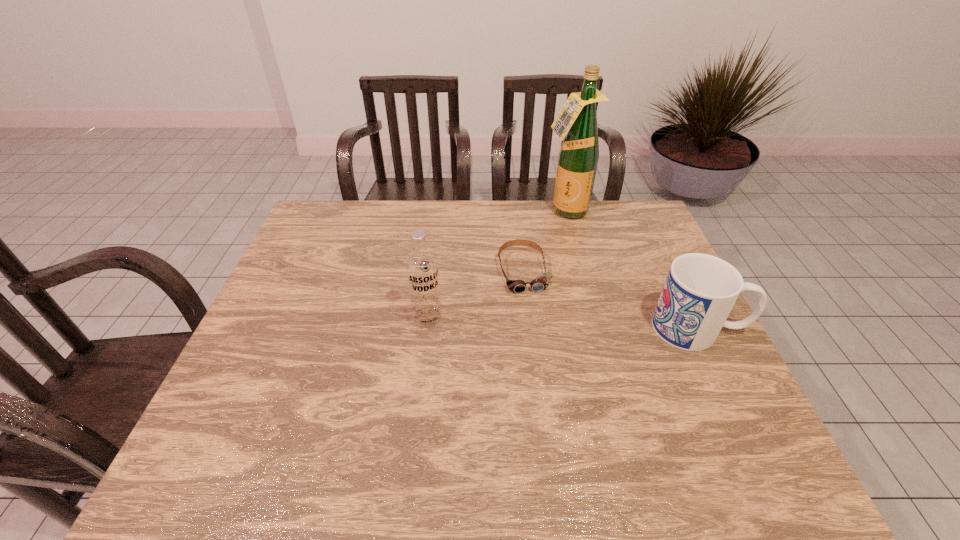
I want to click on vacant space at the left edge, so click(x=299, y=258).

You are a GUI agent. You are given a task and a screenshot of the screen. Output one action in this format:
    pyautogui.click(x=<x>, y=<y>)
    Task: Click on the vacant space at the right edge
    The image size is (960, 540).
    Given the screenshot: What is the action you would take?
    pyautogui.click(x=643, y=315)

The width and height of the screenshot is (960, 540). What are the coordinates of `free spot at the near right corner of the desktop` in the screenshot? It's located at (738, 416).

Locate an element on the screen. vacant area that lies between the liquor and the mug is located at coordinates (632, 269).

At what (x,y) coordinates should I click in order to perform the action: click on free space between the liquor and the vodka. Please return your answer as a coordinate pair (x, y). The image size is (960, 540). Looking at the image, I should click on (496, 264).

Image resolution: width=960 pixels, height=540 pixels. In order to click on vacant space that's between the second farthest object and the vodka in this screenshot , I will do `click(475, 295)`.

Find the location of a particular element. Image resolution: width=960 pixels, height=540 pixels. empty location between the tallest object and the second object from left to right is located at coordinates (544, 241).

Where is `vacant space in between the tallest object and the rightmost object`? Image resolution: width=960 pixels, height=540 pixels. vacant space in between the tallest object and the rightmost object is located at coordinates (632, 269).

Locate an element on the screen. This screenshot has width=960, height=540. free space between the second shortest object and the third shortest object is located at coordinates (563, 323).

Identify the location of vacant area that lies between the second object from right to left and the third shortest object. (496, 264).